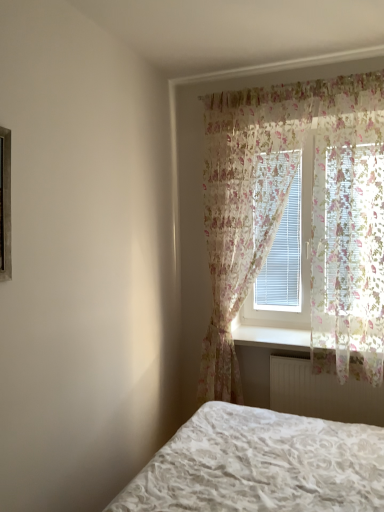
Question: In terms of width, does floral sheer curtain at upper right, arranged as the first curtain when viewed from the right, look wider or thinner when compared to floral sheer curtain at center, which appears as the 1th curtain when viewed from the left?

Choices:
 (A) thin
 (B) wide

Answer: (B)

Question: Considering the positions of floral sheer curtain at upper right, which is counted as the second curtain, starting from the left, and floral sheer curtain at center, which appears as the 1th curtain when viewed from the left, in the image, is floral sheer curtain at upper right, which is counted as the second curtain, starting from the left, taller or shorter than floral sheer curtain at center, which appears as the 1th curtain when viewed from the left,?

Choices:
 (A) short
 (B) tall

Answer: (A)

Question: Estimate the real-world distances between objects in this image. Which object is closer to the white plastic radiator at lower center?

Choices:
 (A) floral sheer curtain at upper right, arranged as the first curtain when viewed from the right
 (B) white matte radiator at lower center
 (C) floral sheer curtain at center, which appears as the second curtain when viewed from the right

Answer: (B)

Question: Based on their relative distances, which object is farther from the white matte radiator at lower center?

Choices:
 (A) floral sheer curtain at upper right, arranged as the first curtain when viewed from the right
 (B) white plastic radiator at lower center
 (C) floral sheer curtain at center, which appears as the 1th curtain when viewed from the left

Answer: (C)